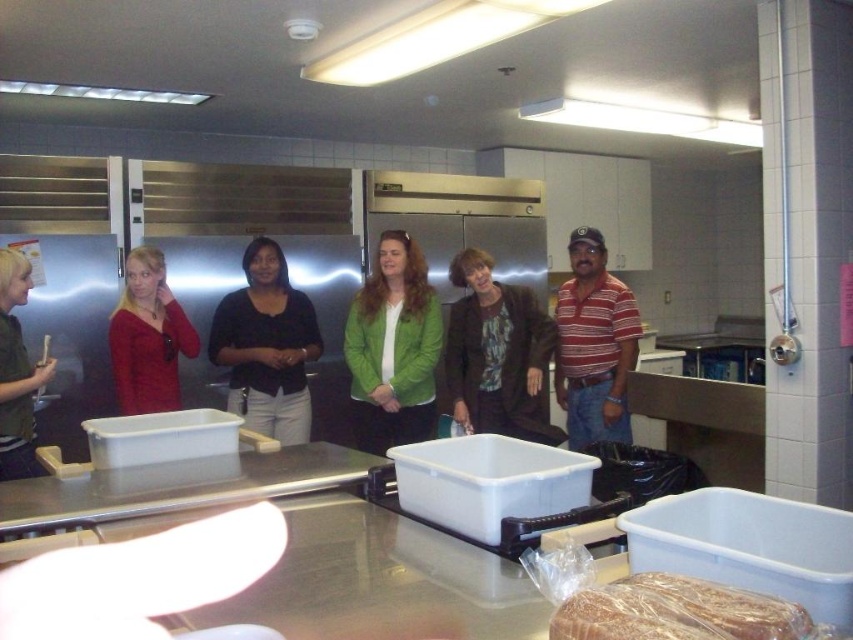
Consider the image. You are a food delivery person who needs to hand a package to the person wearing the green matte jacket at center and the matte red sweater at left. Since you are standing in front of the stainless steel countertop, which person should you approach first based on their positions?

The green matte jacket at center is positioned under matte red sweater at left, so you should approach the matte red sweater at left first since it is closer to you.

You are standing in the commercial kitchen and need to locate the point at coordinates (265, 346). According to the scene description, where exactly is this point located?

The point at coordinates (265, 346) is located on the matte black shirt at center.